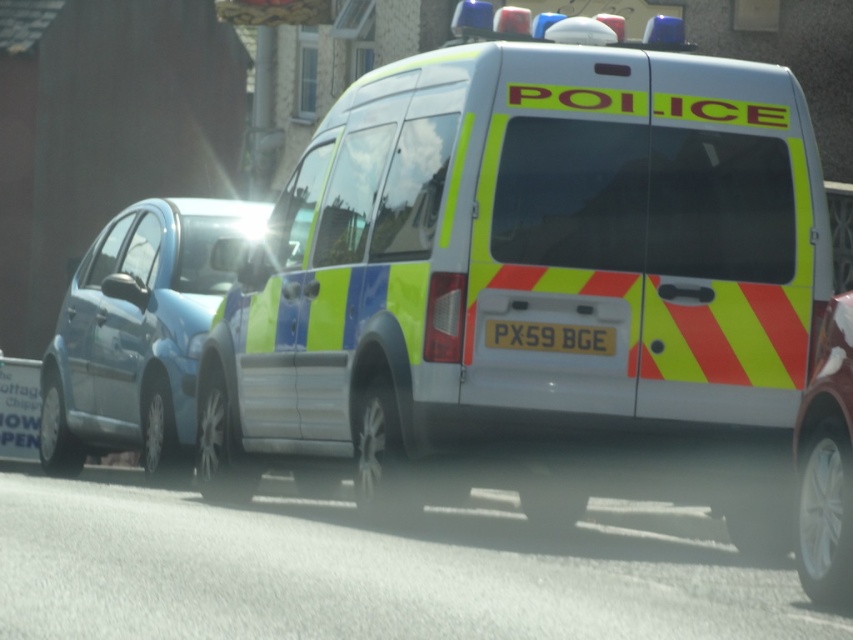
Who is taller, reflective yellow and blue van at center or shiny silver wheel at lower right?

Standing taller between the two is reflective yellow and blue van at center.

Between reflective yellow and blue van at center and shiny silver wheel at lower right, which one has less height?

With less height is shiny silver wheel at lower right.

Which is behind, point (804, 248) or point (848, 360)?

Positioned behind is point (804, 248).

Locate an element on the screen. reflective yellow and blue van at center is located at coordinates (524, 252).

Which is more to the left, reflective yellow and blue van at center or yellow reflective plastic at rear?

Positioned to the left is reflective yellow and blue van at center.

Can you confirm if reflective yellow and blue van at center is bigger than yellow reflective plastic at rear?

Yes, reflective yellow and blue van at center is bigger than yellow reflective plastic at rear.

Does point (758, 384) come behind point (531, 326)?

Yes, point (758, 384) is behind point (531, 326).

What are the coordinates of `reflective yellow and blue van at center` in the screenshot? It's located at (524, 252).

Does shiny silver wheel at lower right have a lesser width compared to yellow reflective plastic at rear?

Indeed, shiny silver wheel at lower right has a lesser width compared to yellow reflective plastic at rear.

Does shiny silver wheel at lower right come in front of yellow reflective plastic at rear?

Yes.

Where is `shiny silver wheel at lower right`? This screenshot has width=853, height=640. shiny silver wheel at lower right is located at coordinates pos(825,464).